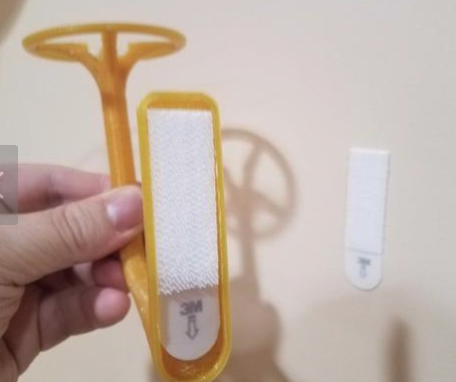
Locate an element on the screen. This screenshot has height=382, width=456. command strip is located at coordinates (370, 264), (180, 306).